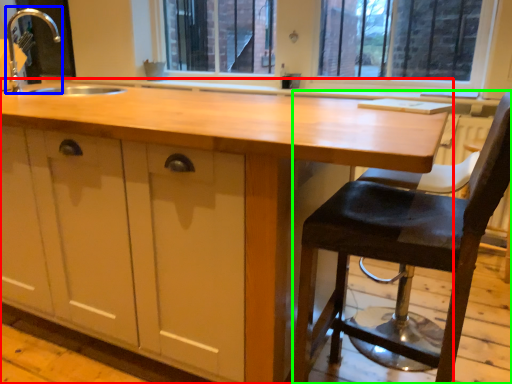
Question: Which is nearer to the countertop (highlighted by a red box)? faucet (highlighted by a blue box) or chair (highlighted by a green box).

Choices:
 (A) faucet
 (B) chair

Answer: (B)